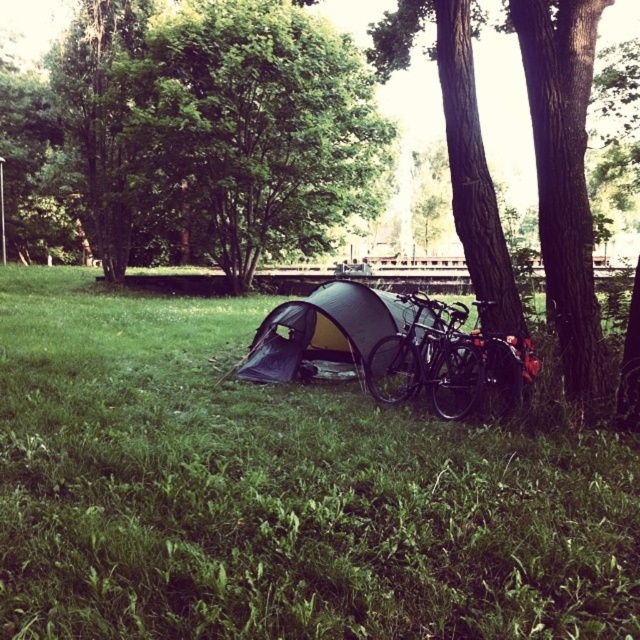
Question: Which object is positioned closest to the green grass at lower center?

Choices:
 (A) green leafy tree at upper center
 (B) shiny black bicycle at right

Answer: (B)

Question: Is green leafy tree at upper center smaller than green fabric tent at center?

Choices:
 (A) no
 (B) yes

Answer: (A)

Question: Which point is closer to the camera taking this photo?

Choices:
 (A) (346, 300)
 (B) (109, 444)

Answer: (B)

Question: Is green leafy tree at upper center wider than shiny black bicycle at right?

Choices:
 (A) yes
 (B) no

Answer: (A)

Question: Can you confirm if green grass at lower center is positioned to the right of shiny black bicycle at right?

Choices:
 (A) no
 (B) yes

Answer: (A)

Question: Estimate the real-world distances between objects in this image. Which object is closer to the green grass at lower center?

Choices:
 (A) shiny black bicycle at right
 (B) green leafy tree at upper center

Answer: (A)